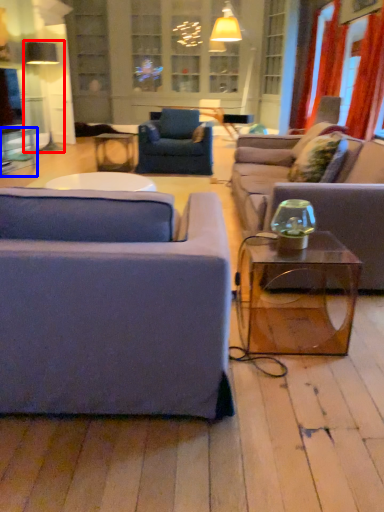
Question: Which object is closer to the camera taking this photo, lamp (highlighted by a red box) or table (highlighted by a blue box)?

Choices:
 (A) lamp
 (B) table

Answer: (B)